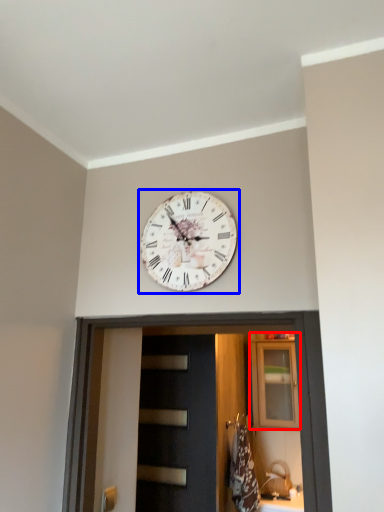
Question: Among these objects, which one is farthest to the camera, cabinetry (highlighted by a red box) or wall clock (highlighted by a blue box)?

Choices:
 (A) cabinetry
 (B) wall clock

Answer: (A)